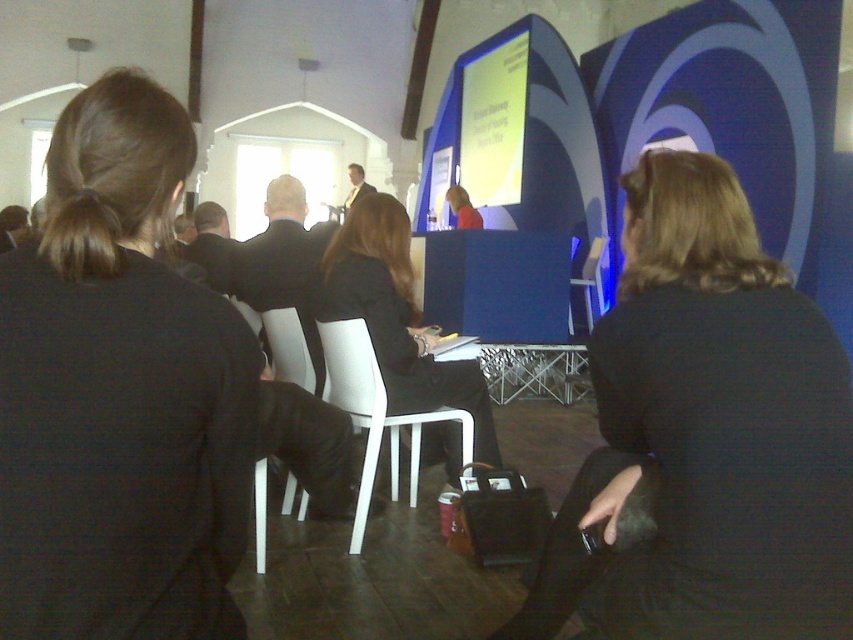
Question: Estimate the real-world distances between objects in this image. Which object is farther from the black fabric jacket at center?

Choices:
 (A) black fabric hair at upper left
 (B) matte black jacket at center
 (C) dark blue fabric jacket at center

Answer: (B)

Question: Which of these objects is positioned farthest from the black fabric jacket at center?

Choices:
 (A) matte black jacket at center
 (B) white plastic chair at center

Answer: (A)

Question: Is dark blue fabric jacket at center positioned in front of black fabric jacket at center?

Choices:
 (A) yes
 (B) no

Answer: (A)

Question: Can you confirm if dark blue fabric jacket at center is thinner than black fabric jacket at center?

Choices:
 (A) no
 (B) yes

Answer: (B)

Question: Is the position of black fabric hair at upper left more distant than that of black fabric jacket at center?

Choices:
 (A) no
 (B) yes

Answer: (A)

Question: Among these objects, which one is nearest to the camera?

Choices:
 (A) black fabric jacket at center
 (B) matte black jacket at center
 (C) black fabric hair at upper left

Answer: (C)